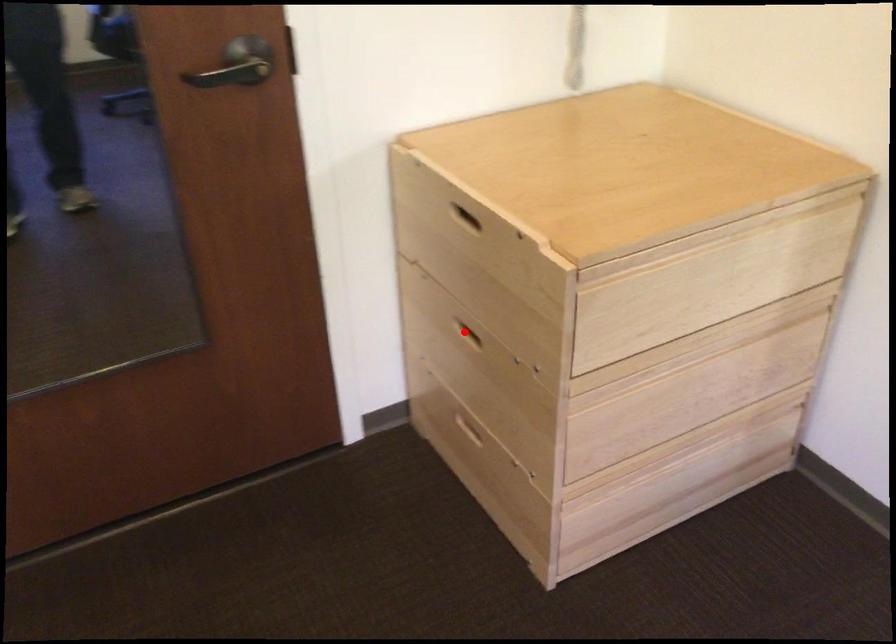
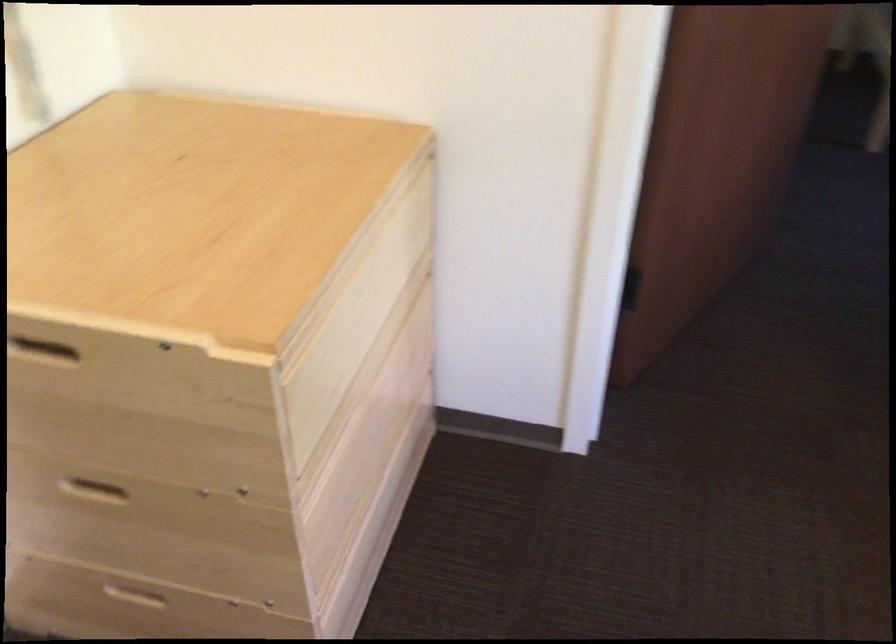
Question: I am providing you with two images of the same scene from different viewpoints. A red point is shown in image1. For the corresponding object point in image2, is it positioned nearer or farther from the camera?

Choices:
 (A) Nearer
 (B) Farther

Answer: (A)